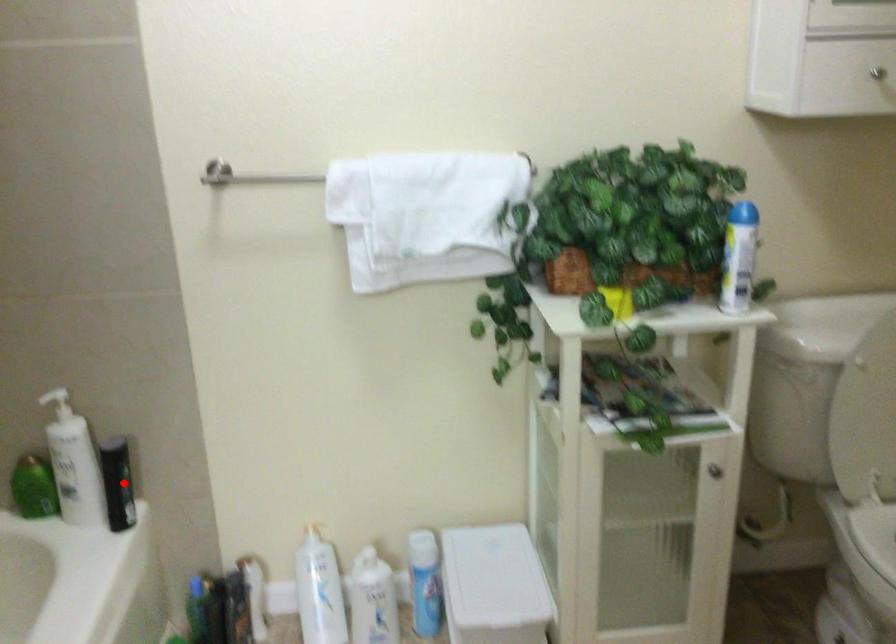
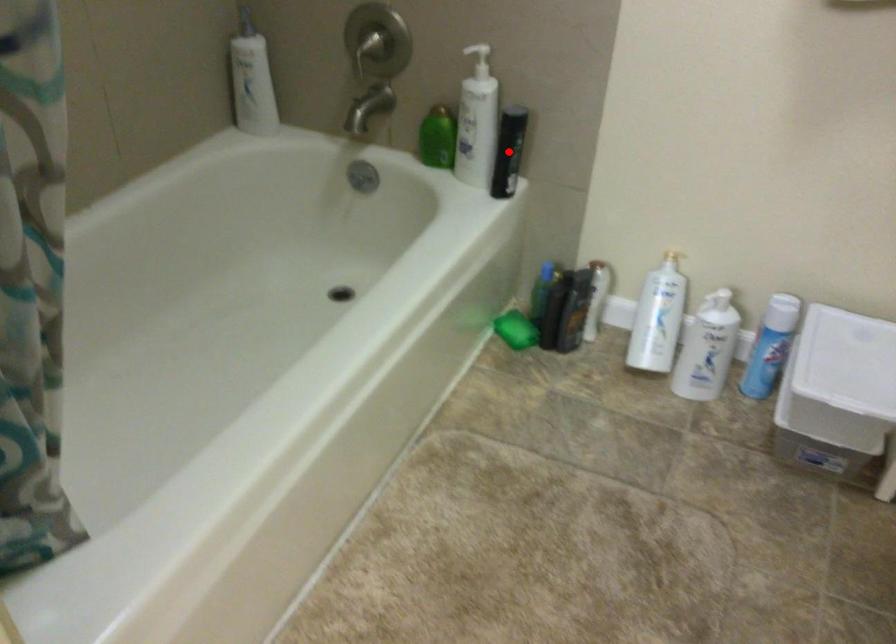
I am providing you with two images of the same scene from different viewpoints. A red point is marked on the first image and another point is marked on the second image. Do the highlighted points in image1 and image2 indicate the same real-world spot?

Yes